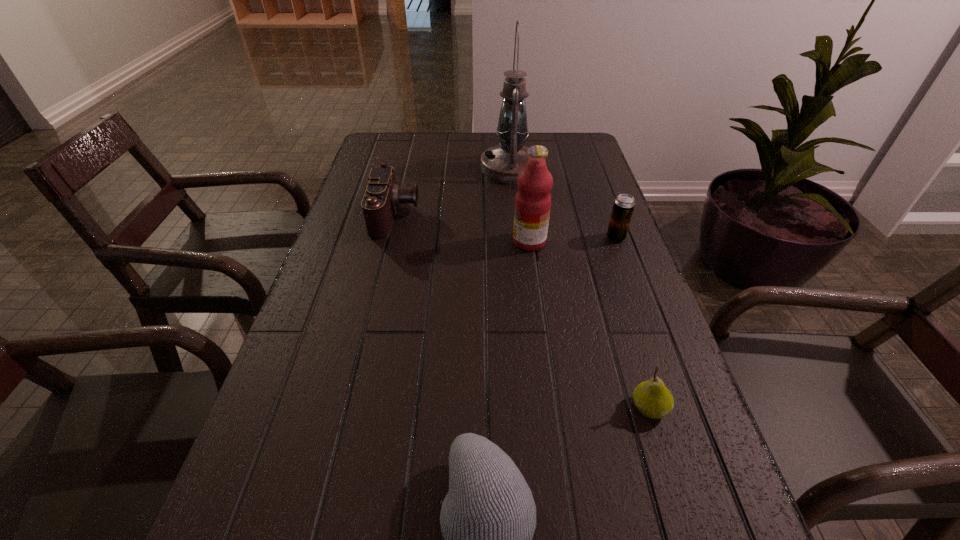
Locate an element on the screen. vacant space that satisfies the following two spatial constraints: 1. on the front-facing side of the leftmost object; 2. on the left side of the beer can is located at coordinates point(391,238).

Locate an element on the screen. This screenshot has width=960, height=540. free space that satisfies the following two spatial constraints: 1. on the front side of the beer can; 2. on the label of the second tallest object is located at coordinates (617, 241).